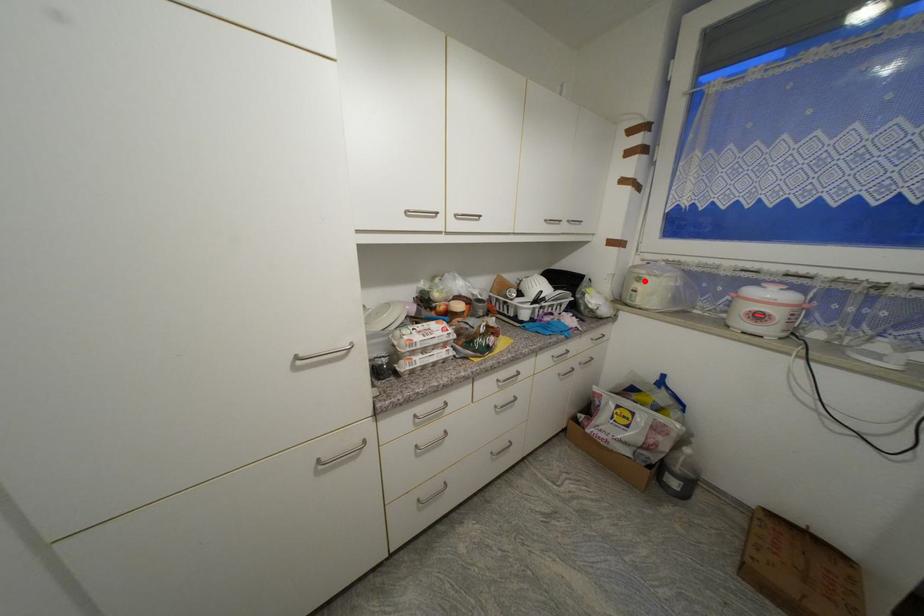
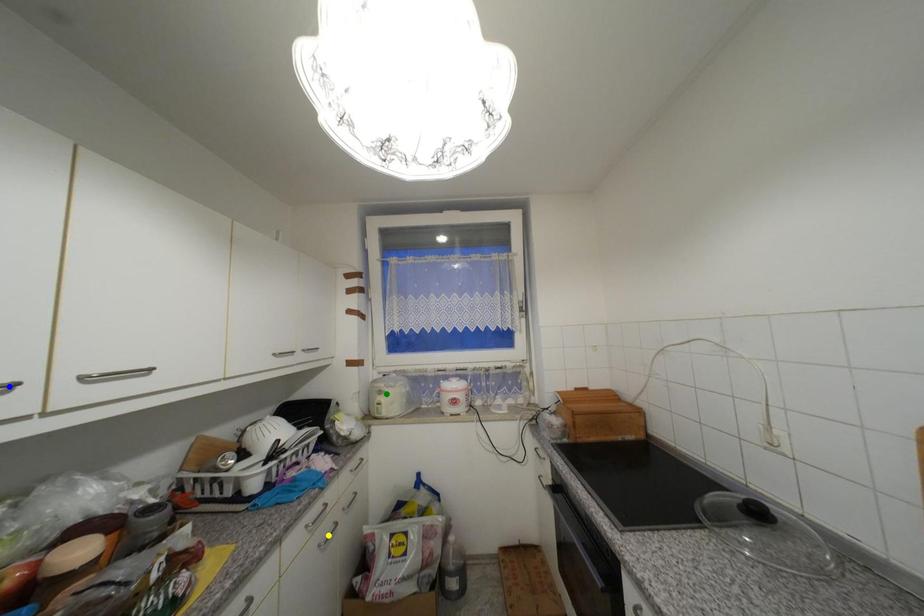
Question: I am providing you with two images of the same scene from different viewpoints. A red point is marked on the first image. You are given multiple points on the second image. Which point in image 2 is actually the same real-world point as the red point in image 1?

Choices:
 (A) green point
 (B) blue point
 (C) yellow point

Answer: (A)